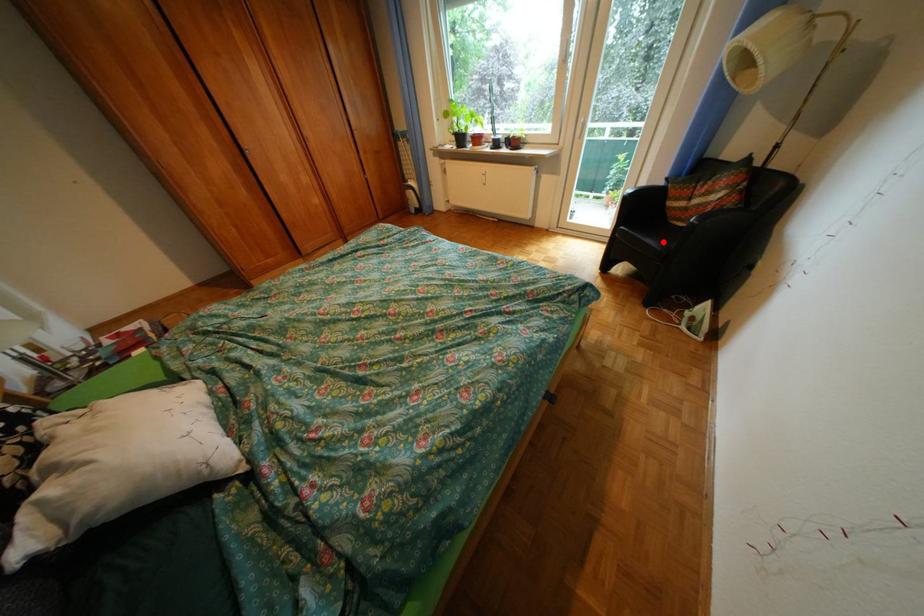
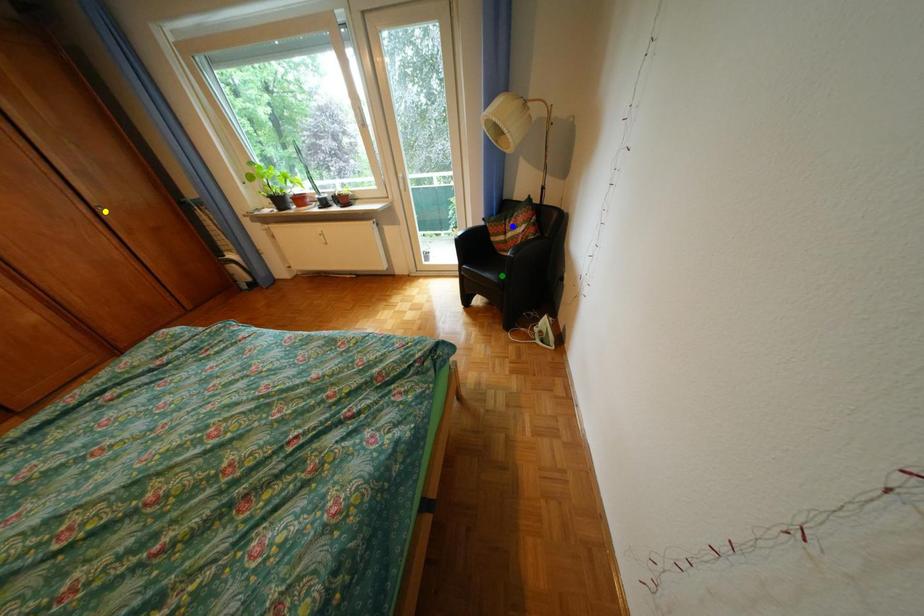
Question: I am providing you with two images of the same scene from different viewpoints. A red point is marked on the first image. You are given multiple points on the second image. In image 2, which mark is for the same physical point as the one in image 1?

Choices:
 (A) blue point
 (B) green point
 (C) yellow point

Answer: (B)